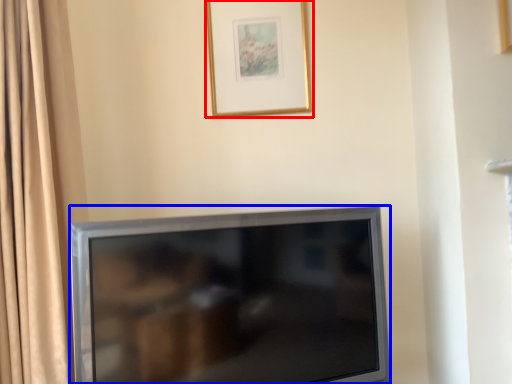
Question: Which object is further to the camera taking this photo, picture frame (highlighted by a red box) or television (highlighted by a blue box)?

Choices:
 (A) picture frame
 (B) television

Answer: (A)